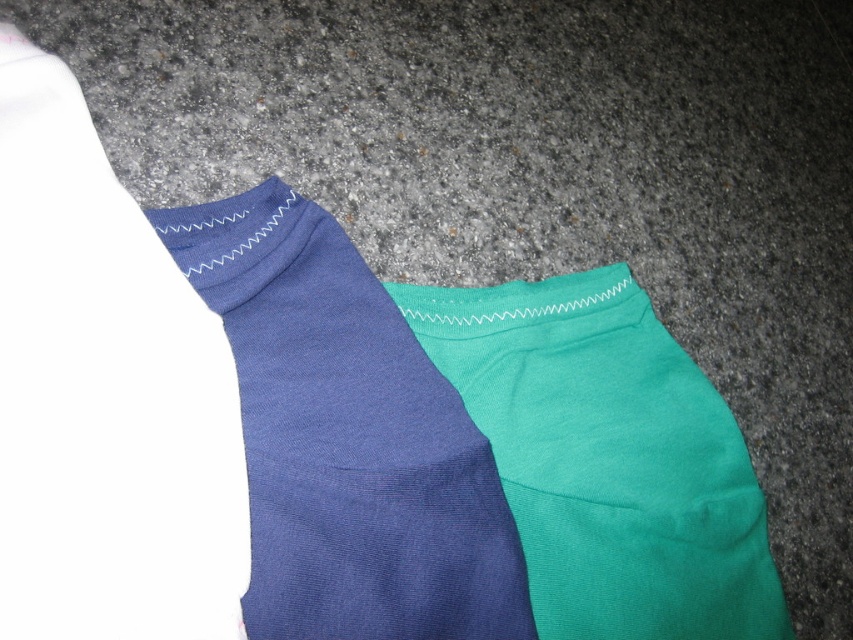
Is matte blue socks at center bigger than teal smooth shorts at center?

Actually, matte blue socks at center might be smaller than teal smooth shorts at center.

Can you confirm if matte blue socks at center is shorter than teal smooth shorts at center?

No.

You are a GUI agent. You are given a task and a screenshot of the screen. Output one action in this format:
    pyautogui.click(x=<x>, y=<y>)
    Task: Click on the matte blue socks at center
    Image resolution: width=853 pixels, height=640 pixels.
    Given the screenshot: What is the action you would take?
    pyautogui.click(x=346, y=438)